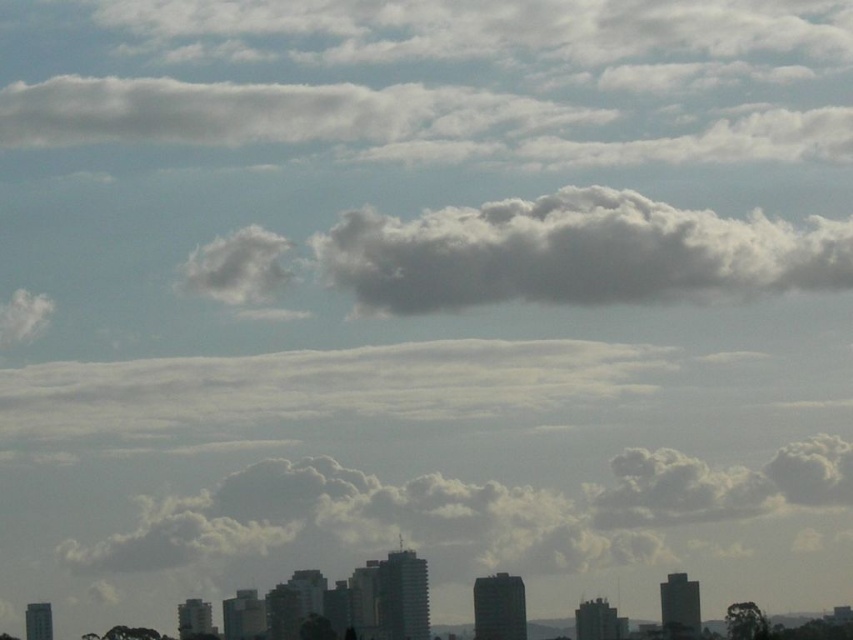
Question: Is white fluffy cloud at center to the right of gray fluffy cloud at upper center from the viewer's perspective?

Choices:
 (A) no
 (B) yes

Answer: (B)

Question: Which object is the closest to the white fluffy cloud at upper center?

Choices:
 (A) gray fluffy cloud at upper center
 (B) white fluffy cloud at center
 (C) white fluffy cloud at upper left

Answer: (A)

Question: Which point is farther to the camera?

Choices:
 (A) (440, 124)
 (B) (289, 244)
 (C) (704, 234)
 (D) (42, 298)

Answer: (D)

Question: Which point is closer to the camera?

Choices:
 (A) (161, 115)
 (B) (762, 269)
 (C) (223, 260)

Answer: (C)

Question: In this image, where is white fluffy cloud at upper center located relative to white fluffy cloud at upper left?

Choices:
 (A) above
 (B) below

Answer: (A)

Question: Is gray fluffy cloud at upper center to the right of white fluffy cloud at upper left from the viewer's perspective?

Choices:
 (A) yes
 (B) no

Answer: (A)